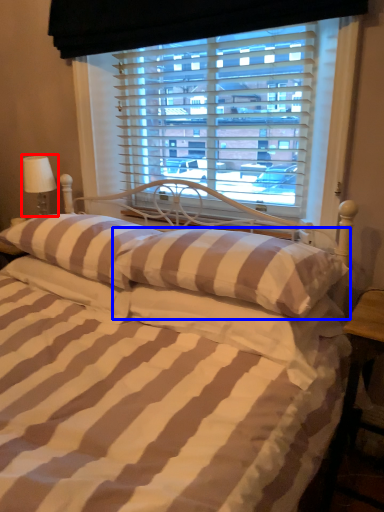
Question: Which point is further to the camera, table lamp (highlighted by a red box) or pillow (highlighted by a blue box)?

Choices:
 (A) table lamp
 (B) pillow

Answer: (A)